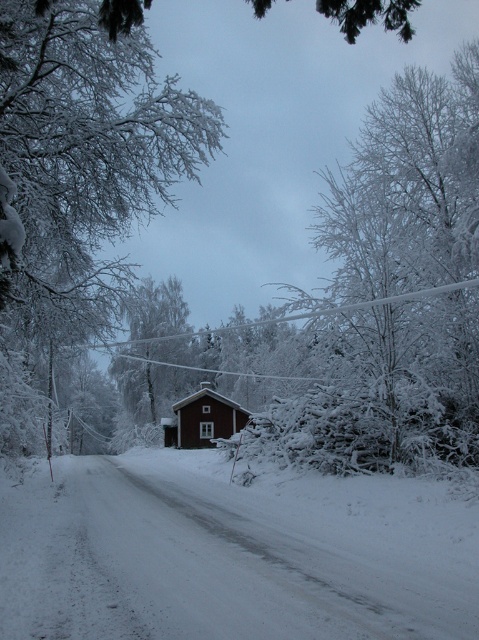
Who is positioned more to the right, white fluffy snow at center or red wooden house at center?

white fluffy snow at center

Does point (342, 531) come in front of point (215, 390)?

Yes, it is.

Between point (239, 612) and point (240, 424), which one is positioned in front?

Point (239, 612) is more forward.

Locate an element on the screen. This screenshot has height=640, width=479. white fluffy snow at center is located at coordinates (230, 552).

Can you confirm if white fluffy snow at center is thinner than white frosty branches at center?

Yes.

Is white fluffy snow at center shorter than white frosty branches at center?

Yes.

Is point (465, 566) behind point (128, 72)?

No, it is not.

This screenshot has height=640, width=479. Identify the location of white fluffy snow at center. click(x=230, y=552).

Is white frosty branches at center shorter than red wooden house at center?

Incorrect, white frosty branches at center's height does not fall short of red wooden house at center's.

Is white frosty branches at center behind red wooden house at center?

That is False.

What do you see at coordinates (77, 180) in the screenshot? Image resolution: width=479 pixels, height=640 pixels. I see `white frosty branches at center` at bounding box center [77, 180].

Locate an element on the screen. The image size is (479, 640). white frosty branches at center is located at coordinates (77, 180).